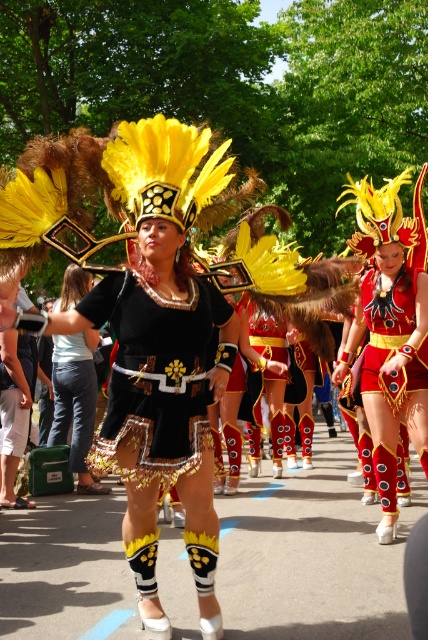
Question: Based on their relative distances, which object is farther from the shiny red fabric shorts at center?

Choices:
 (A) shiny red fabric dress at center
 (B) black matte fabric skirt at center

Answer: (B)

Question: Which object is the closest to the shiny red fabric shorts at center?

Choices:
 (A) black matte fabric skirt at center
 (B) matte black dress at center
 (C) shiny red fabric dress at center

Answer: (C)

Question: Is black matte fabric skirt at center in front of shiny red fabric shorts at center?

Choices:
 (A) no
 (B) yes

Answer: (B)

Question: Among these points, which one is farthest from the camera?

Choices:
 (A) (400, 387)
 (B) (104, 298)
 (C) (82, 285)
 (D) (398, 257)

Answer: (C)

Question: Is black matte fabric skirt at center wider than shiny red fabric dress at center?

Choices:
 (A) yes
 (B) no

Answer: (A)

Question: Does shiny red fabric dress at center have a greater width compared to shiny red fabric shorts at center?

Choices:
 (A) yes
 (B) no

Answer: (A)